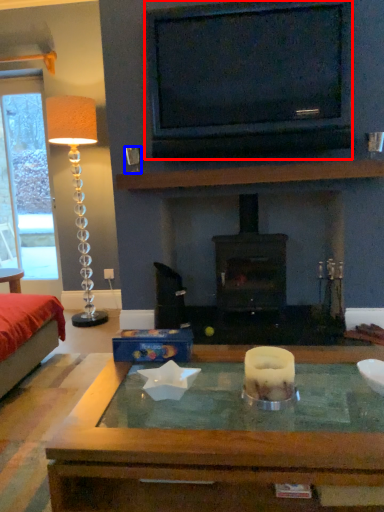
Question: Which object is further to the camera taking this photo, television (highlighted by a red box) or coffee cup (highlighted by a blue box)?

Choices:
 (A) television
 (B) coffee cup

Answer: (B)